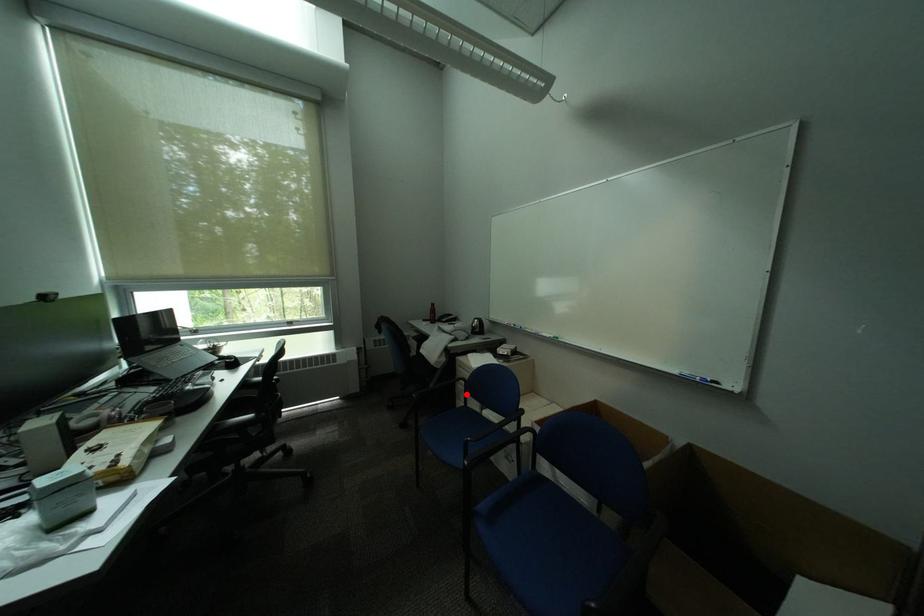
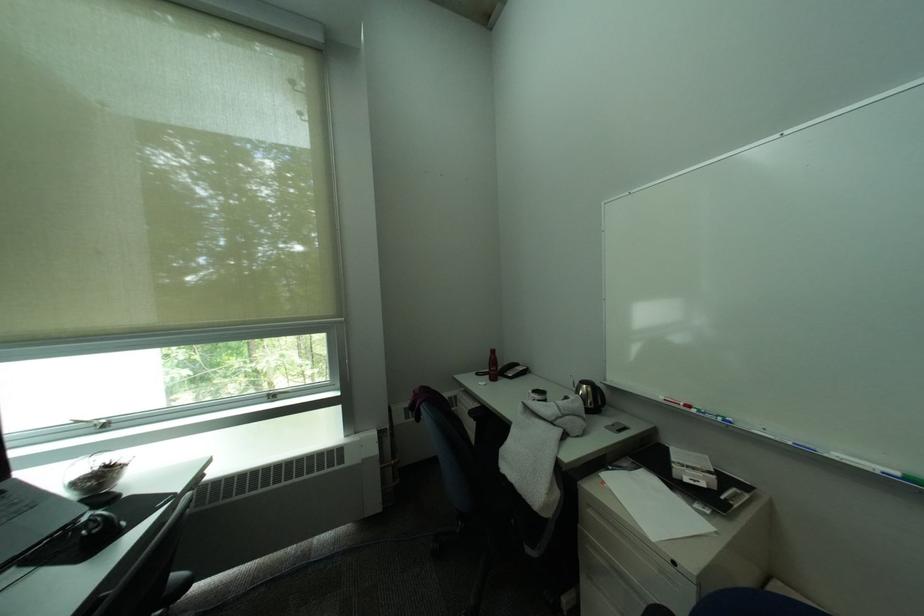
Find the pixel in the second image that matches the highlighted location in the first image.

(590, 561)